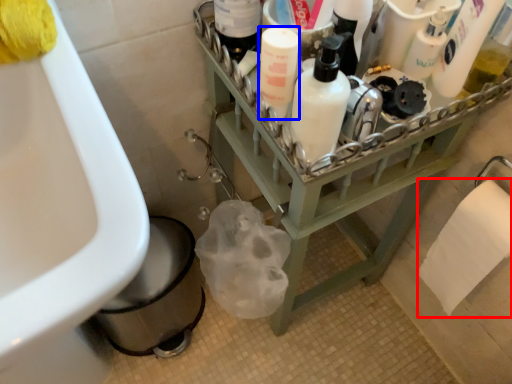
Question: Which of the following is the closest to the observer, toilet paper (highlighted by a red box) or cleaning product (highlighted by a blue box)?

Choices:
 (A) toilet paper
 (B) cleaning product

Answer: (B)